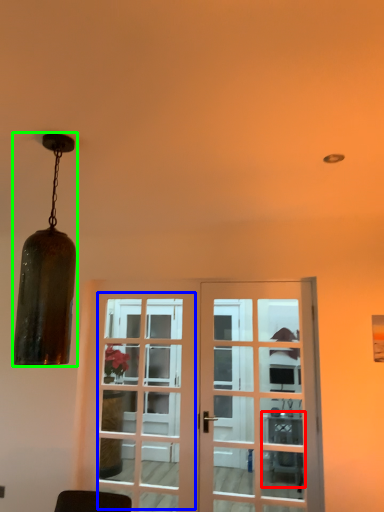
Question: Estimate the real-world distances between objects in this image. Which object is farther from table (highlighted by a red box), screen door (highlighted by a blue box) or lamp (highlighted by a green box)?

Choices:
 (A) screen door
 (B) lamp

Answer: (B)